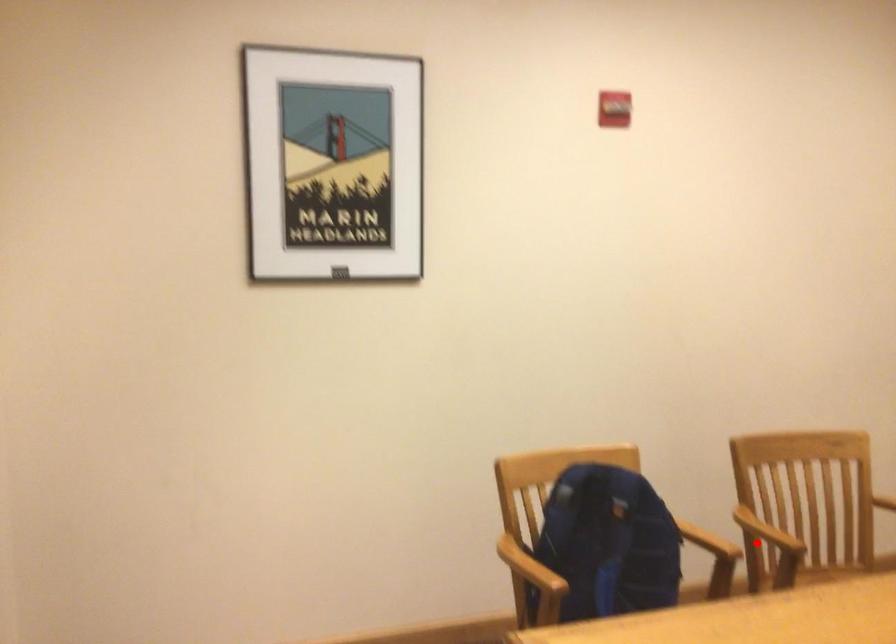
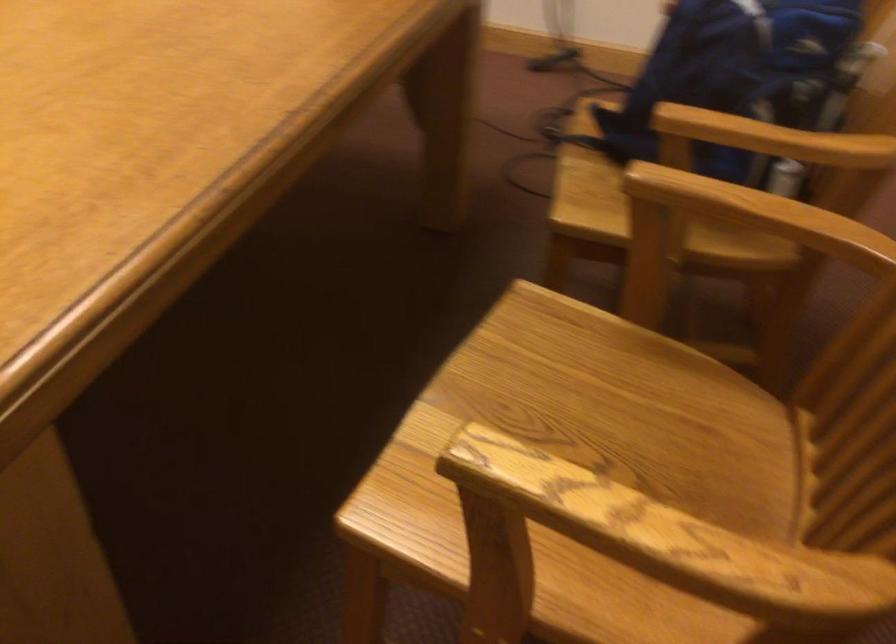
Question: I am providing you with two images of the same scene from different viewpoints. Given a red point in image1, look at the same physical point in image2. Is it:

Choices:
 (A) Closer to the viewpoint
 (B) Farther from the viewpoint

Answer: (A)